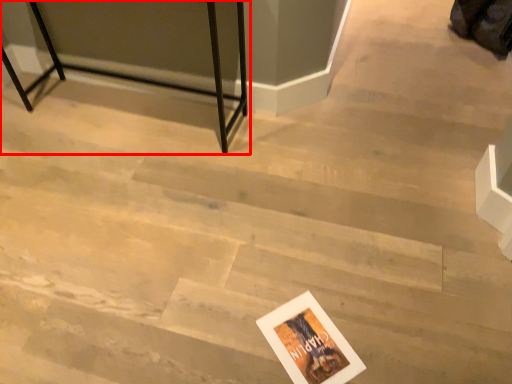
Question: From the image, what is the correct spatial relationship of furniture (annotated by the red box) in relation to postcard?

Choices:
 (A) left
 (B) right

Answer: (A)